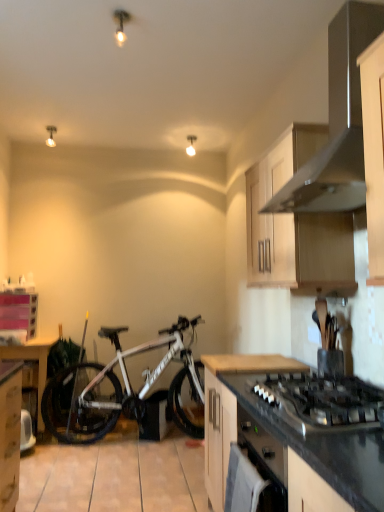
I want to click on free space above wooden at center, which appears as the 1th countertop when viewed from the top (from a real-world perspective), so click(251, 357).